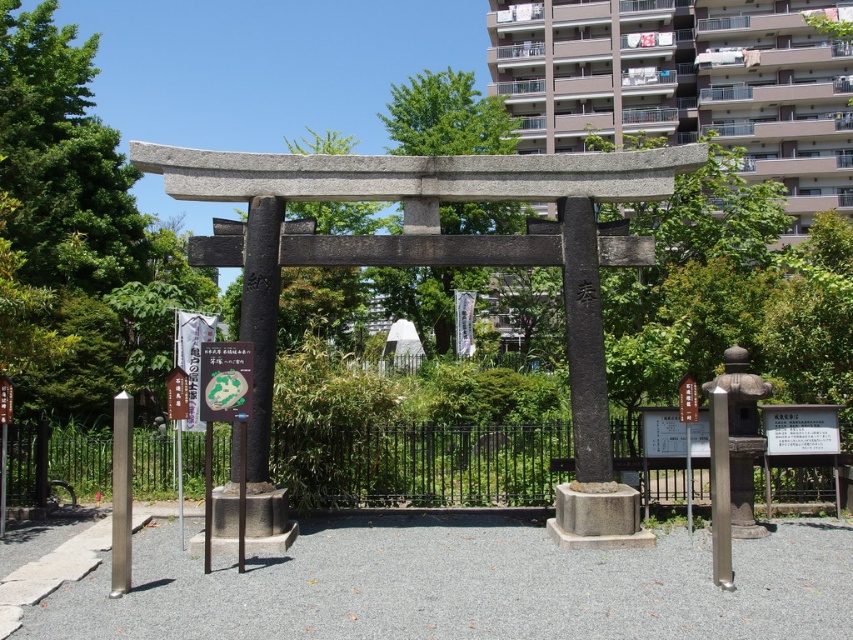
Based on the photo, you are a visitor standing in front of the torii gate and see the green paper at center and the wooden signpost at center. Which object is nearer to you?

The green paper at center is closer to the viewer than the wooden signpost at center.

You are a visitor at the torii gate and want to place both the green paper at center and the wooden signpost at center on a shelf that is 1 meter wide. Can both items fit side by side without overlapping?

The green paper at center is wider than the wooden signpost at center. Since the shelf is 1 meter wide, it depends on the combined width of both items. If their total width is less than or equal to 1 meter, they can fit. However, without knowing their exact dimensions, we cannot confirm for certain.